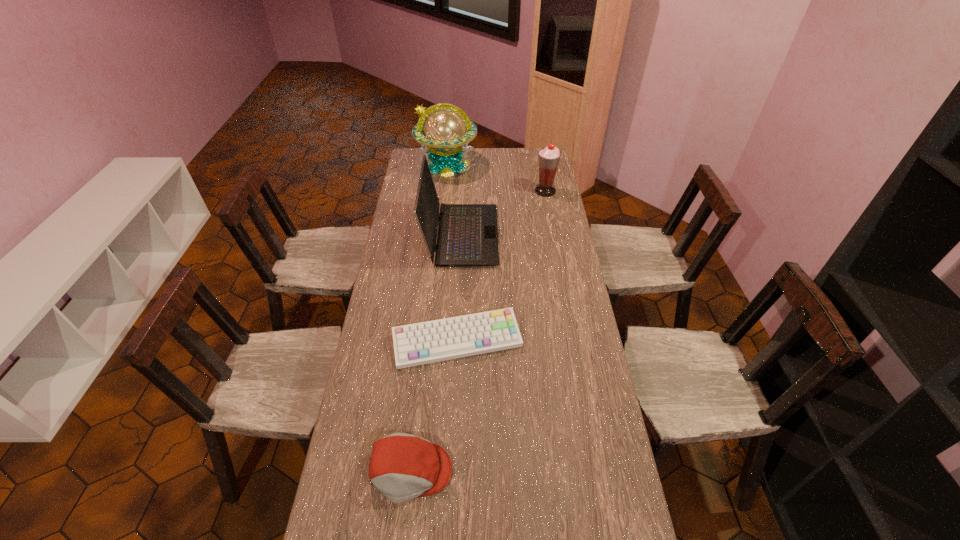
In the image, there is a desktop. Identify the location of vacant space at the far edge. (492, 163).

The height and width of the screenshot is (540, 960). I want to click on free space at the left edge of the desktop, so click(376, 328).

Find the location of `vacant space at the right edge`. vacant space at the right edge is located at coordinates (542, 220).

At what (x,y) coordinates should I click in order to perform the action: click on free space between the second shortest object and the tallest object. Please return your answer as a coordinate pair (x, y). Image resolution: width=960 pixels, height=540 pixels. Looking at the image, I should click on (428, 318).

Where is `vacant area that lies between the fourth farthest object and the fourth nearest object`? The height and width of the screenshot is (540, 960). vacant area that lies between the fourth farthest object and the fourth nearest object is located at coordinates (501, 266).

The width and height of the screenshot is (960, 540). Identify the location of vacant area between the computer keyboard and the second farthest object. (501, 266).

This screenshot has height=540, width=960. I want to click on free area in between the laptop computer and the fourth nearest object, so click(x=503, y=213).

Where is `the third closest object relative to the second farthest object`? The width and height of the screenshot is (960, 540). the third closest object relative to the second farthest object is located at coordinates (427, 342).

Identify which object is the third closest to the computer keyboard. Please provide its 2D coordinates. Your answer should be formatted as a tuple, i.e. [(x, y)], where the tuple contains the x and y coordinates of a point satisfying the conditions above.

[(548, 157)]

Find the location of a particular element. vacant area that satisfies the following two spatial constraints: 1. on the back side of the shortest object; 2. on the screen of the third nearest object is located at coordinates (462, 235).